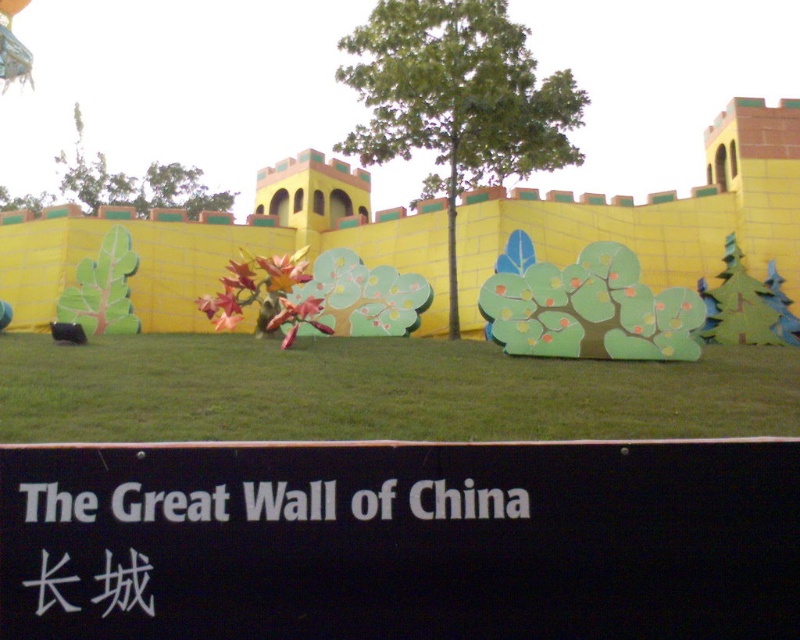
The height and width of the screenshot is (640, 800). What are the coordinates of `green grass at center` in the screenshot? It's located at (377, 392).

Between green grass at center and green leafy tree at upper left, which one has less height?

With less height is green grass at center.

Is point (684, 388) behind point (168, 195)?

No, (684, 388) is in front of (168, 195).

Where is `green grass at center`? green grass at center is located at coordinates (377, 392).

Is black plastic sign at lower center positioned behind green grass at center?

No, it is in front of green grass at center.

Between black plastic sign at lower center and green grass at center, which one has more height?

With more height is black plastic sign at lower center.

Between point (449, 586) and point (594, 368), which one is positioned in front?

Point (449, 586) is in front.

Locate an element on the screen. This screenshot has height=640, width=800. black plastic sign at lower center is located at coordinates (400, 540).

Can you confirm if green leafy tree at center is positioned above white plastic sign at center?

Correct, green leafy tree at center is located above white plastic sign at center.

Based on the photo, is green leafy tree at center taller than white plastic sign at center?

Yes, green leafy tree at center is taller than white plastic sign at center.

Who is more forward, (568,115) or (297,509)?

Point (297,509)

Find the location of `green leafy tree at center`. green leafy tree at center is located at coordinates (458, 99).